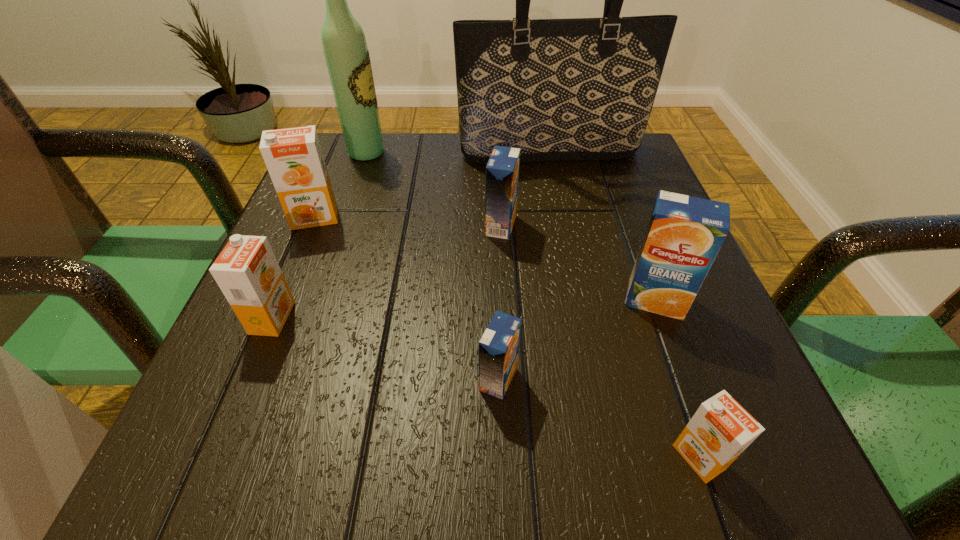
At what (x,y) coordinates should I click in order to perform the action: click on vacant area that lies between the second nearest blue orange_juice and the nearest object. Please return your answer as a coordinate pair (x, y). Looking at the image, I should click on (677, 379).

Identify the location of vacant region between the farthest blue orange_juice and the tallest object. (525, 189).

At what (x,y) coordinates should I click in order to perform the action: click on free spot between the second biggest orange orange juice and the farthest blue orange_juice. Please return your answer as a coordinate pair (x, y). Image resolution: width=960 pixels, height=540 pixels. Looking at the image, I should click on (387, 272).

In order to click on empty space between the farthest orange orange juice and the seventh shortest object in this screenshot , I will do `click(341, 185)`.

Select which object appears as the fourth closest to the tote bag. Please provide its 2D coordinates. Your answer should be formatted as a tuple, i.e. [(x, y)], where the tuple contains the x and y coordinates of a point satisfying the conditions above.

[(684, 235)]

Choose which object is the seventh nearest neighbor to the tallest object. Please provide its 2D coordinates. Your answer should be formatted as a tuple, i.e. [(x, y)], where the tuple contains the x and y coordinates of a point satisfying the conditions above.

[(721, 429)]

Select which orange juice is the fifth closest to the second farthest orange orange juice. Please provide its 2D coordinates. Your answer should be formatted as a tuple, i.e. [(x, y)], where the tuple contains the x and y coordinates of a point satisfying the conditions above.

[(721, 429)]

Locate an element on the screen. The height and width of the screenshot is (540, 960). orange juice that is the fifth closest to the second nearest orange orange juice is located at coordinates (721, 429).

I want to click on orange orange juice that can be found as the third closest to the rightmost blue orange_juice, so click(x=247, y=272).

Identify the location of orange orange juice object that ranks as the closest to the seventh shortest object. The height and width of the screenshot is (540, 960). (293, 156).